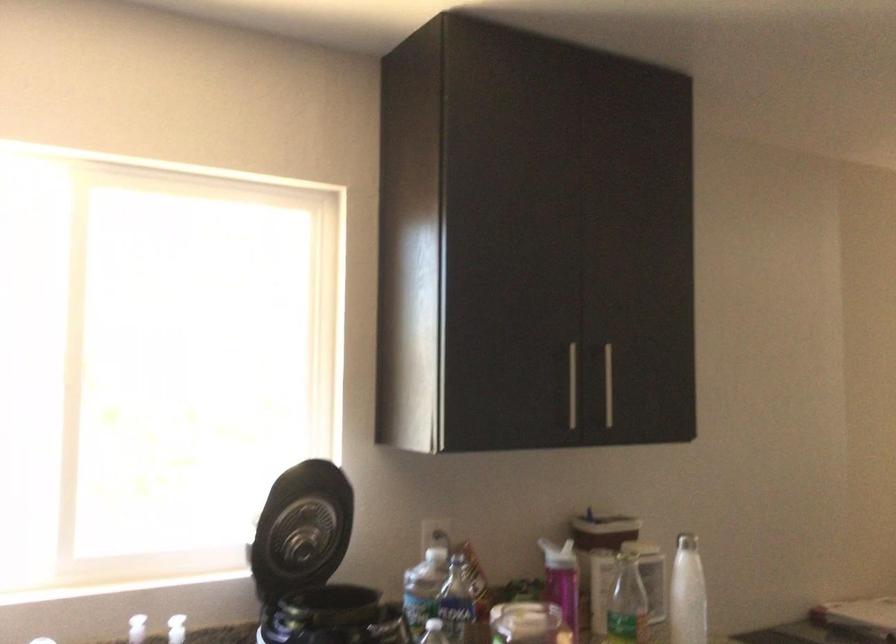
Image resolution: width=896 pixels, height=644 pixels. I want to click on black appliance lid, so click(302, 529).